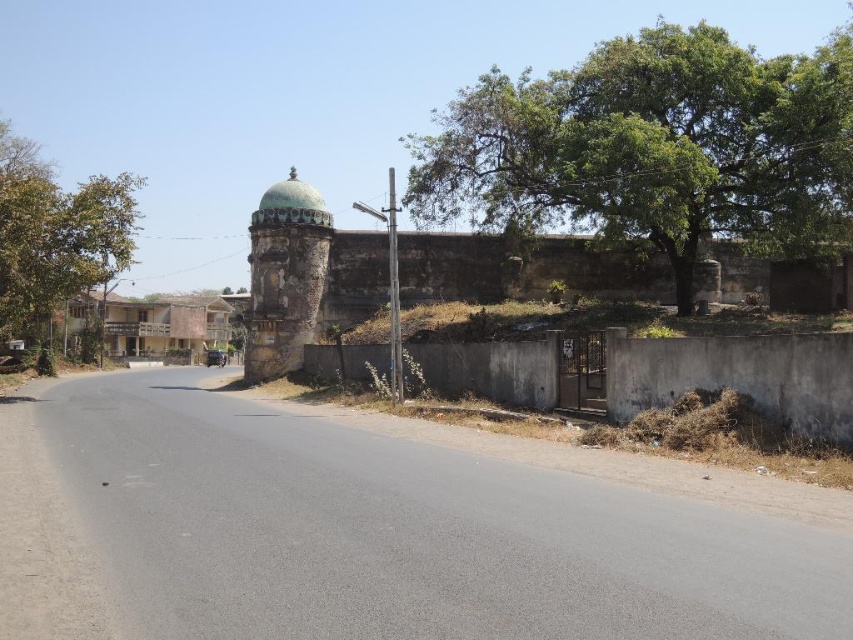
You are standing at the starting point of the road in the rural scene. You notice two points marked on the image. The first point is at coordinates point (848, 172) and the second is at point (543, 280). Which point is closer to you as you face the road?

Point (848, 172) is in front of point (543, 280), so the first point is closer to you.

You are a hiker standing on the paved road in the scene. You notice two green leafy trees. Which tree, the green leafy tree at upper right or the green leafy tree at left, is closer to you?

The green leafy tree at upper right is positioned over the green leafy tree at left, meaning it is closer to you.

You are standing at the origin point in the image. There is a green leafy tree at upper right located at point (653, 147). A large stone wall with a small gate is on the right side of the road. Can you tell me the direction of the green leafy tree at upper right relative to the large stone wall with a small gate?

The green leafy tree at upper right is located at point (653, 147), which is northeast of the large stone wall with a small gate.